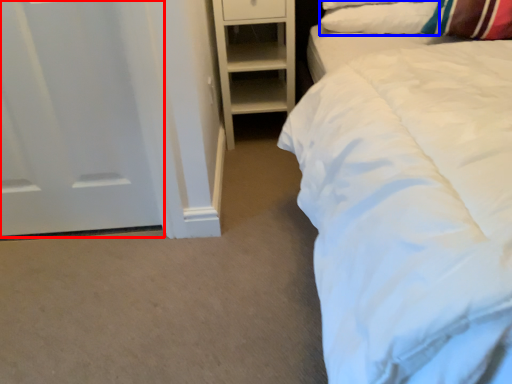
Question: Which point is closer to the camera, door (highlighted by a red box) or pillow (highlighted by a blue box)?

Choices:
 (A) door
 (B) pillow

Answer: (A)